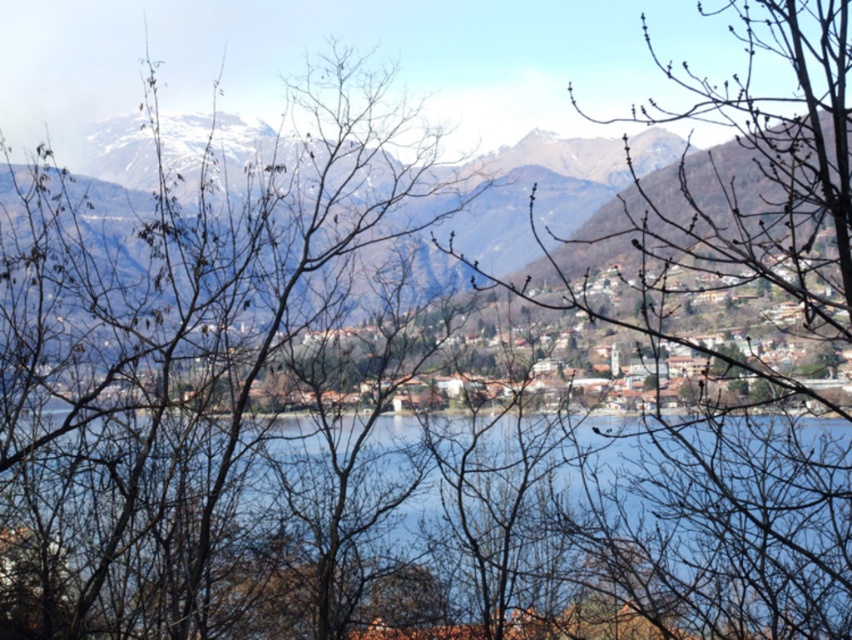
Between point (320, 625) and point (491, 243), which one is positioned in front?

Positioned in front is point (320, 625).

Measure the distance between point (413, 627) and camera.

Point (413, 627) and camera are 710.03 feet apart.

The width and height of the screenshot is (852, 640). I want to click on blue water at center, so click(x=447, y=536).